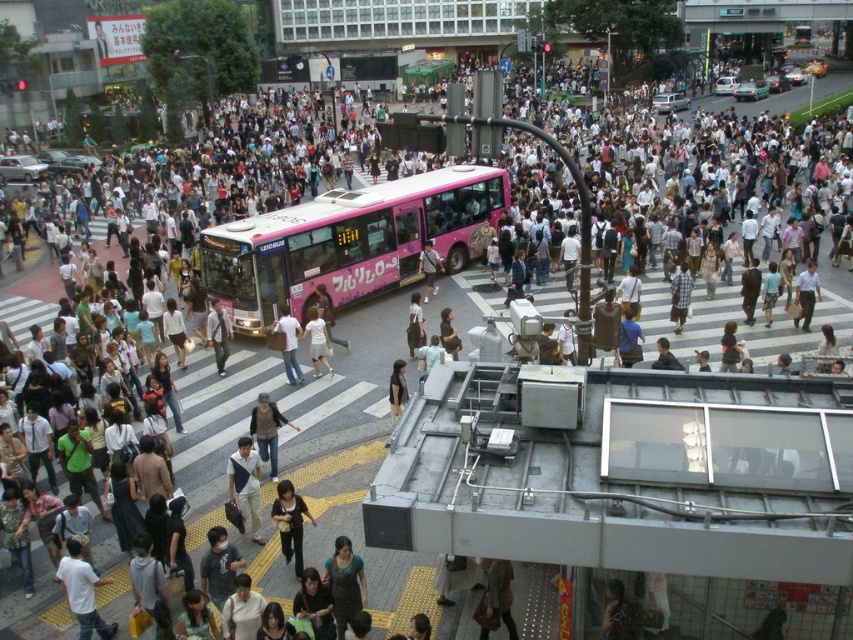
You are standing at the point marked by coordinates point[347,241] in the image. What object is located at this point?

The pink matte bus at center is located at point[347,241].

You are a photographer trying to capture a candid shot of the denim jacket at center and the light brown fabric pants at center in the busy urban scene. To ensure both subjects are in frame, you need to know their relative widths. Can you determine which one is wider?

The denim jacket at center might be wider than light brown fabric pants at center, so the denim jacket at center is likely wider than the light brown fabric pants at center.

You are standing at the crosswalk near the pink Yoido Bus and want to reach both points marked in the image. Which point, point (x=289, y=481) or point (x=222, y=365), would you reach first if you walk straight ahead?

You would reach point (x=289, y=481) first because it is closer to you than point (x=222, y=365).